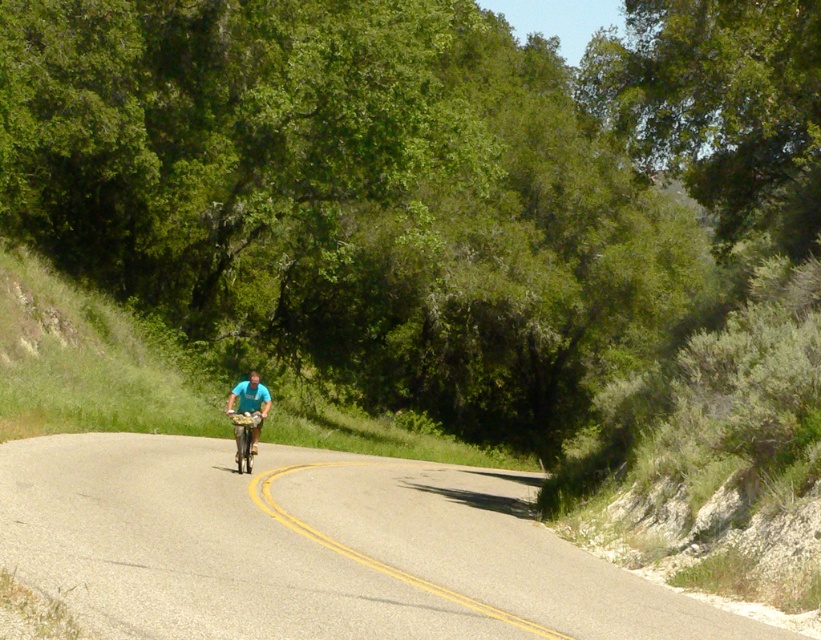
Who is positioned more to the right, gray asphalt road at center or blue matte shirt at center?

From the viewer's perspective, gray asphalt road at center appears more on the right side.

Can you confirm if gray asphalt road at center is bigger than blue matte shirt at center?

Correct, gray asphalt road at center is larger in size than blue matte shirt at center.

Is point (537, 611) behind point (257, 378)?

No, (537, 611) is in front of (257, 378).

Identify the location of gray asphalt road at center. (310, 547).

Which is above, blue matte shirt at center or shiny metallic bicycle at center?

blue matte shirt at center is above.

Who is more forward, (237, 435) or (244, 419)?

Point (244, 419)

The image size is (821, 640). In order to click on blue matte shirt at center in this screenshot , I will do `click(250, 403)`.

Between gray asphalt road at center and shiny metallic bicycle at center, which one has more height?

Standing taller between the two is gray asphalt road at center.

Who is more forward, (368, 536) or (250, 472)?

Point (368, 536) is in front.

Locate an element on the screen. gray asphalt road at center is located at coordinates (310, 547).